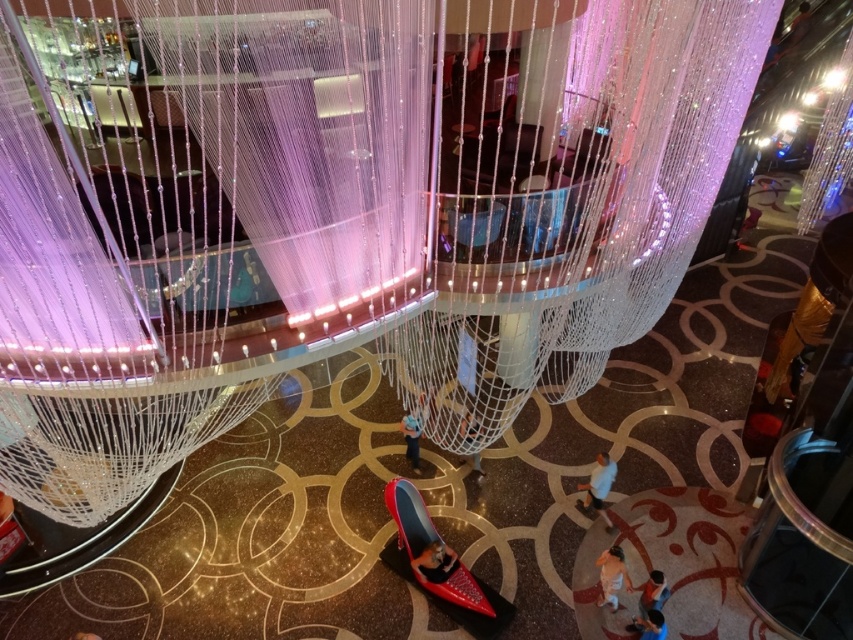
You are a photographer setting up equipment in the room. You need to place a tripod between the matte black shoe at lower center and the blue fabric person at lower right. Can you fit the tripod there if it requires 30 cm of space?

The matte black shoe at lower center might be wider than blue fabric person at lower right, but since the exact width isn

You are a photographer setting up for an event in this space. You need to position a spotlight on the orange fabric person at lower right without casting a shadow on the blue denim jeans at center. Is this possible based on their current positions?

The orange fabric person at lower right is positioned under the blue denim jeans at center, so placing a spotlight on the orange fabric person at lower right would cast a shadow upwards. Since the blue denim jeans at center is above it, the shadow would likely fall on the jeans, making it impossible to avoid casting a shadow on them.